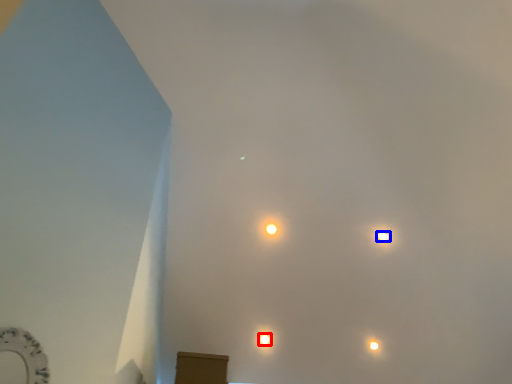
Question: Which object is closer to the camera taking this photo, lamp (highlighted by a red box) or lamp (highlighted by a blue box)?

Choices:
 (A) lamp
 (B) lamp

Answer: (B)